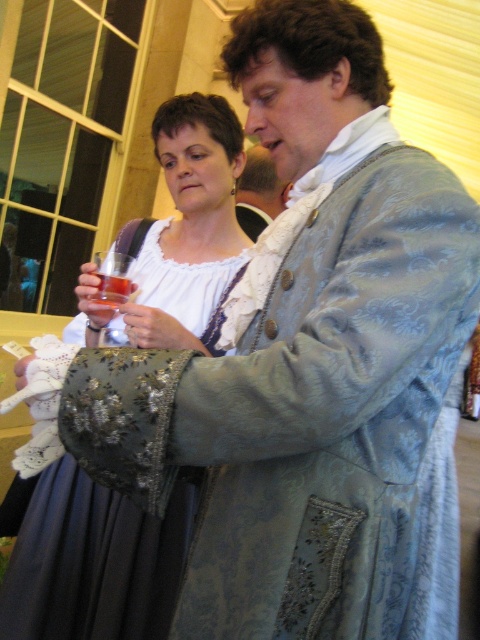
Is matte white lace dress at center bigger than translucent glass at upper left?

Indeed, matte white lace dress at center has a larger size compared to translucent glass at upper left.

Identify the location of matte white lace dress at center. (93, 563).

Who is more distant from viewer, (262,220) or (116,275)?

The point (262,220) is behind.

Is point (271, 209) positioned after point (120, 288)?

Yes, point (271, 209) is farther from viewer.

Who is more distant from viewer, (247, 188) or (116, 298)?

The point (247, 188) is more distant.

I want to click on silvery brocade coat at upper center, so click(x=259, y=193).

Is matte white lace dress at center wider than silvery brocade coat at upper center?

Indeed, matte white lace dress at center has a greater width compared to silvery brocade coat at upper center.

Which of these two, matte white lace dress at center or silvery brocade coat at upper center, stands shorter?

matte white lace dress at center

The height and width of the screenshot is (640, 480). In order to click on matte white lace dress at center in this screenshot , I will do `click(93, 563)`.